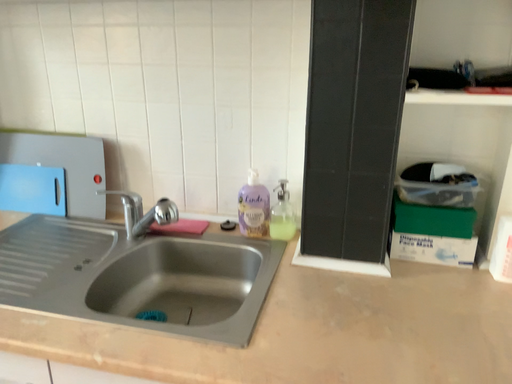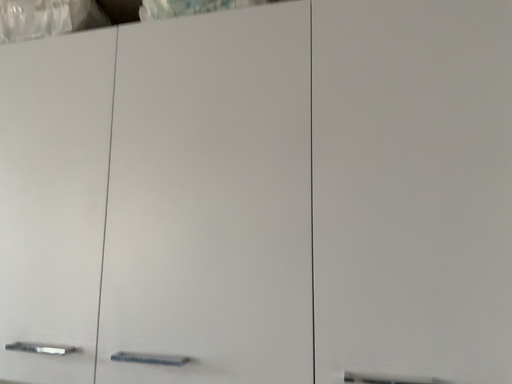
Question: Which way did the camera rotate in the video?

Choices:
 (A) rotated downward
 (B) rotated upward

Answer: (B)